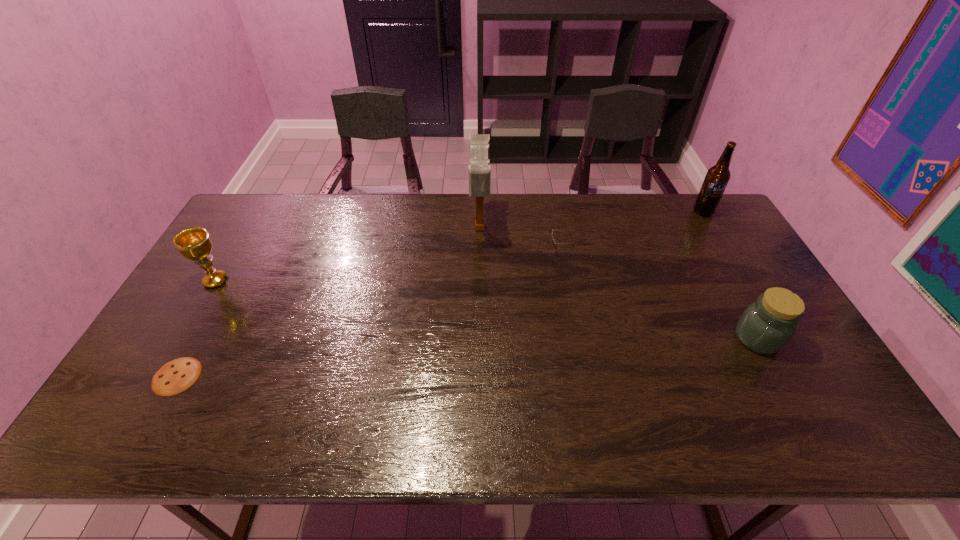
The width and height of the screenshot is (960, 540). What are the coordinates of `free location located 0.390m on the back of the fourth farthest object` in the screenshot? It's located at (265, 198).

You are a GUI agent. You are given a task and a screenshot of the screen. Output one action in this format:
    pyautogui.click(x=<x>, y=<y>)
    Task: Click on the free region located 0.220m on the left of the jar
    
    Given the screenshot: What is the action you would take?
    pyautogui.click(x=652, y=338)

Find the location of a particular element. This screenshot has height=540, width=960. vacant space located 0.290m in front of the lenses of the third object from right to left is located at coordinates (459, 251).

Find the location of a particular element. vacant region located in front of the lenses of the third object from right to left is located at coordinates (468, 251).

Where is `free space located in front of the lenses of the third object from right to left`? The height and width of the screenshot is (540, 960). free space located in front of the lenses of the third object from right to left is located at coordinates (428, 251).

Image resolution: width=960 pixels, height=540 pixels. Identify the location of vacant position located on the back of the cookie. (229, 282).

Where is `mallet situated at the far edge`? The height and width of the screenshot is (540, 960). mallet situated at the far edge is located at coordinates (479, 169).

Locate an element on the screen. This screenshot has width=960, height=540. beer bottle that is at the far edge is located at coordinates (717, 177).

Locate an element on the screen. The height and width of the screenshot is (540, 960). sunglasses that is at the far edge is located at coordinates (553, 242).

Where is `chalice that is at the left edge`? The image size is (960, 540). chalice that is at the left edge is located at coordinates (194, 243).